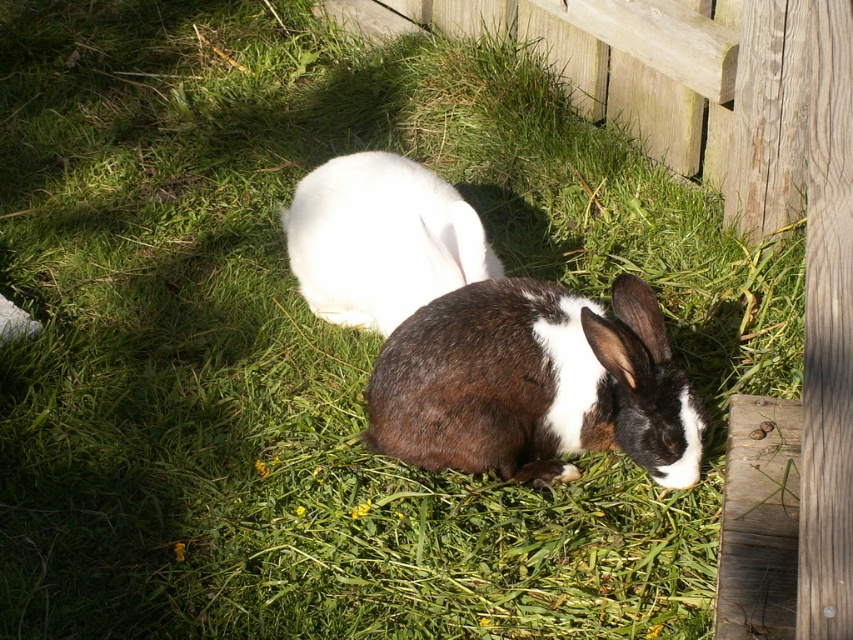
Does point (660, 426) come closer to viewer compared to point (463, 252)?

Yes, it is in front of point (463, 252).

Which is more to the right, brown fuzzy rabbit at center or white fluffy rabbit at center?

Positioned to the right is brown fuzzy rabbit at center.

Find the location of a particular element. This screenshot has height=640, width=853. brown fuzzy rabbit at center is located at coordinates (534, 384).